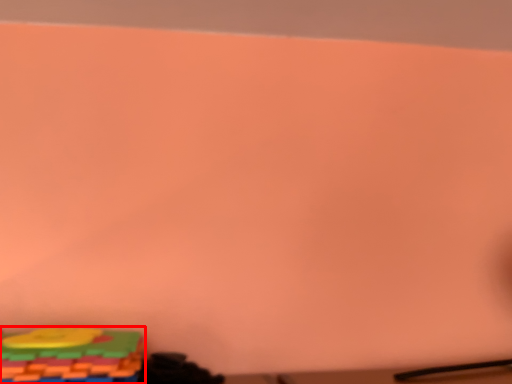
Question: From the image's perspective, what is the correct spatial relationship of toy (annotated by the red box) in relation to toy?

Choices:
 (A) below
 (B) above

Answer: (B)